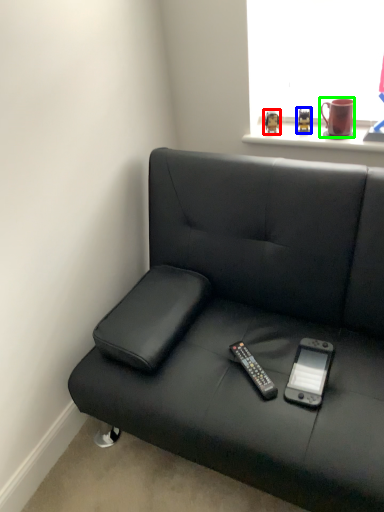
Question: Which is nearer to the toy (highlighted by a red box)? toy (highlighted by a blue box) or mug (highlighted by a green box).

Choices:
 (A) toy
 (B) mug

Answer: (A)